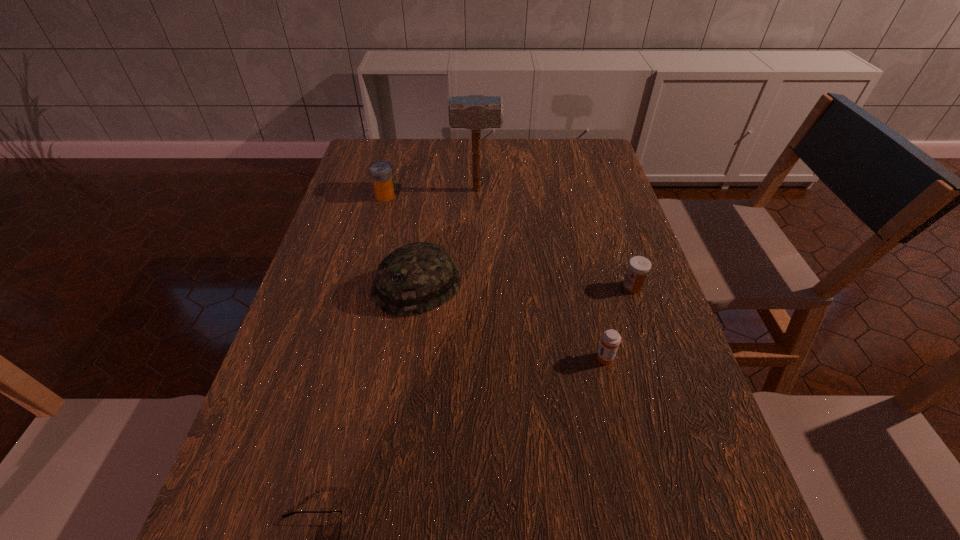
Identify the location of unoccupied area between the tallest medicine and the second medicine from right to left. (495, 276).

Where is `vacant space that is in between the tallest object and the rightmost object`? This screenshot has width=960, height=540. vacant space that is in between the tallest object and the rightmost object is located at coordinates (554, 239).

The width and height of the screenshot is (960, 540). In order to click on free space between the headwear and the farthest medicine in this screenshot , I will do `click(401, 241)`.

This screenshot has height=540, width=960. In order to click on free spot between the mallet and the nearest medicine in this screenshot , I will do `click(540, 274)`.

At what (x,y) coordinates should I click in order to perform the action: click on free spot between the headwear and the rightmost medicine. Please return your answer as a coordinate pair (x, y). This screenshot has height=540, width=960. Looking at the image, I should click on (524, 287).

Find the location of a particular element. unoccupied area between the tallest object and the second farthest medicine is located at coordinates (554, 239).

Identify which object is the closest to the leftmost medicine. Please provide its 2D coordinates. Your answer should be formatted as a tuple, i.e. [(x, y)], where the tuple contains the x and y coordinates of a point satisfying the conditions above.

[(475, 112)]

Where is `the fourth closest object to the second farthest medicine`? the fourth closest object to the second farthest medicine is located at coordinates (381, 172).

Locate an element on the screen. medicine that is the closest one to the tallest medicine is located at coordinates 638,267.

You are a GUI agent. You are given a task and a screenshot of the screen. Output one action in this format:
    pyautogui.click(x=<x>, y=<y>)
    Task: Click on the closest medicine to the rightmost medicine
    
    Given the screenshot: What is the action you would take?
    pyautogui.click(x=610, y=341)